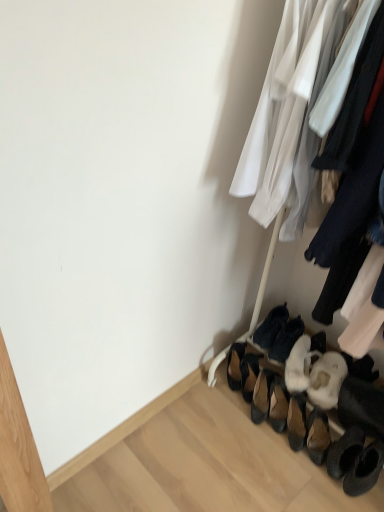
Question: Is leather/textured shoe at lower center, placed as the second footwear when sorted from left to right, placed right next to black suede heels at lower right, the 4th footwear in the right-to-left sequence?

Choices:
 (A) yes
 (B) no

Answer: (A)

Question: Is leather/textured shoe at lower center, which is the 3th footwear from right to left, to the right of black suede heels at lower right, the first footwear when ordered from left to right, from the viewer's perspective?

Choices:
 (A) yes
 (B) no

Answer: (A)

Question: From a real-world perspective, is leather/textured shoe at lower center, which is the 3th footwear from right to left, physically above black suede heels at lower right, the first footwear when ordered from left to right?

Choices:
 (A) yes
 (B) no

Answer: (A)

Question: From a real-world perspective, does leather/textured shoe at lower center, placed as the second footwear when sorted from left to right, sit lower than black suede heels at lower right, the 4th footwear in the right-to-left sequence?

Choices:
 (A) yes
 (B) no

Answer: (B)

Question: Can you confirm if leather/textured shoe at lower center, which is the 3th footwear from right to left, is shorter than black suede heels at lower right, the 4th footwear in the right-to-left sequence?

Choices:
 (A) no
 (B) yes

Answer: (B)

Question: Relative to black suede heels at lower right, the first footwear when ordered from left to right, is dark blue suede shoes at lower right, the 1th footwear in the right-to-left sequence, in front or behind?

Choices:
 (A) front
 (B) behind

Answer: (A)

Question: From the image's perspective, is dark blue suede shoes at lower right, the fourth footwear from the left, positioned above or below black suede heels at lower right, the 4th footwear in the right-to-left sequence?

Choices:
 (A) above
 (B) below

Answer: (A)

Question: Looking at their shapes, would you say dark blue suede shoes at lower right, the 1th footwear in the right-to-left sequence, is wider or thinner than black suede heels at lower right, the 4th footwear in the right-to-left sequence?

Choices:
 (A) thin
 (B) wide

Answer: (B)

Question: Is dark blue suede shoes at lower right, the fourth footwear from the left, inside the boundaries of black suede heels at lower right, the 4th footwear in the right-to-left sequence, or outside?

Choices:
 (A) outside
 (B) inside

Answer: (A)

Question: In terms of width, does leather/textured shoe at lower center, placed as the second footwear when sorted from left to right, look wider or thinner when compared to black suede heels at lower right, the 4th footwear in the right-to-left sequence?

Choices:
 (A) thin
 (B) wide

Answer: (A)

Question: Considering the positions of leather/textured shoe at lower center, which is the 3th footwear from right to left, and black suede heels at lower right, the 4th footwear in the right-to-left sequence, in the image, is leather/textured shoe at lower center, which is the 3th footwear from right to left, bigger or smaller than black suede heels at lower right, the 4th footwear in the right-to-left sequence,?

Choices:
 (A) big
 (B) small

Answer: (B)

Question: Visually, is leather/textured shoe at lower center, placed as the second footwear when sorted from left to right, positioned to the left or to the right of black suede heels at lower right, the first footwear when ordered from left to right?

Choices:
 (A) right
 (B) left

Answer: (A)

Question: Is point (248, 359) positioned closer to the camera than point (233, 362)?

Choices:
 (A) farther
 (B) closer

Answer: (B)

Question: From a real-world perspective, is black suede heels at lower right, the first footwear when ordered from left to right, above or below dark blue suede shoes at lower right, the 1th footwear in the right-to-left sequence?

Choices:
 (A) above
 (B) below

Answer: (B)

Question: Do you think black suede heels at lower right, the first footwear when ordered from left to right, is within dark blue suede shoes at lower right, the 1th footwear in the right-to-left sequence, or outside of it?

Choices:
 (A) outside
 (B) inside

Answer: (A)